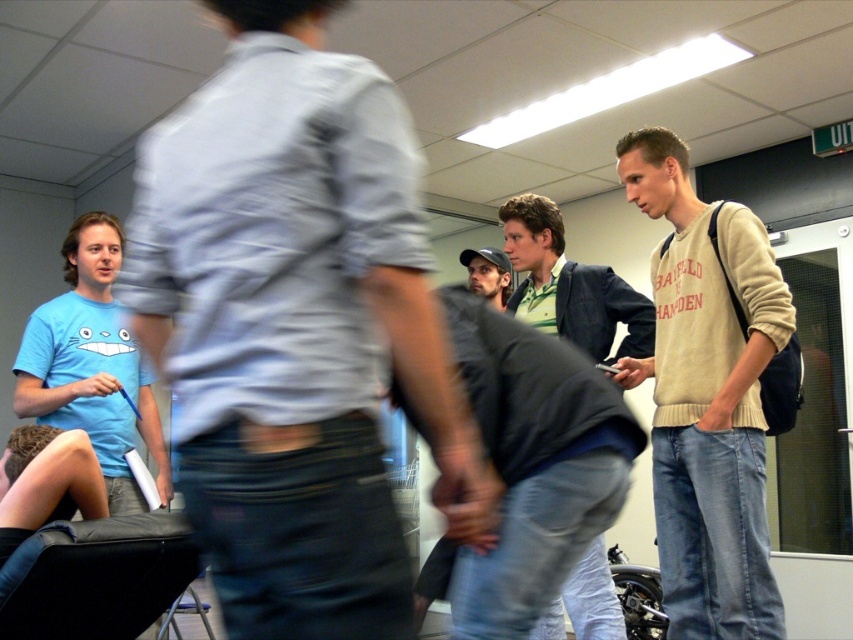
Does blue matte t-shirt at left lie behind matte black cap at center?

No.

Is blue matte t-shirt at left bigger than matte black cap at center?

Yes.

Who is more forward, (90, 371) or (492, 300)?

Point (90, 371) is more forward.

Find the location of a particular element. The image size is (853, 640). blue matte t-shirt at left is located at coordinates (91, 365).

Does light blue t-shirt at upper left appear on the right side of green textured shirt at center?

Incorrect, light blue t-shirt at upper left is not on the right side of green textured shirt at center.

Image resolution: width=853 pixels, height=640 pixels. Describe the element at coordinates (294, 328) in the screenshot. I see `light blue t-shirt at upper left` at that location.

Image resolution: width=853 pixels, height=640 pixels. I want to click on light blue t-shirt at upper left, so [294, 328].

Is blue matte t-shirt at left shorter than black leather chair at lower left?

No.

Is blue matte t-shirt at left in front of black leather chair at lower left?

No, it is not.

Is point (126, 440) farther from viewer compared to point (102, 579)?

Yes.

Identify the location of blue matte t-shirt at left. (91, 365).